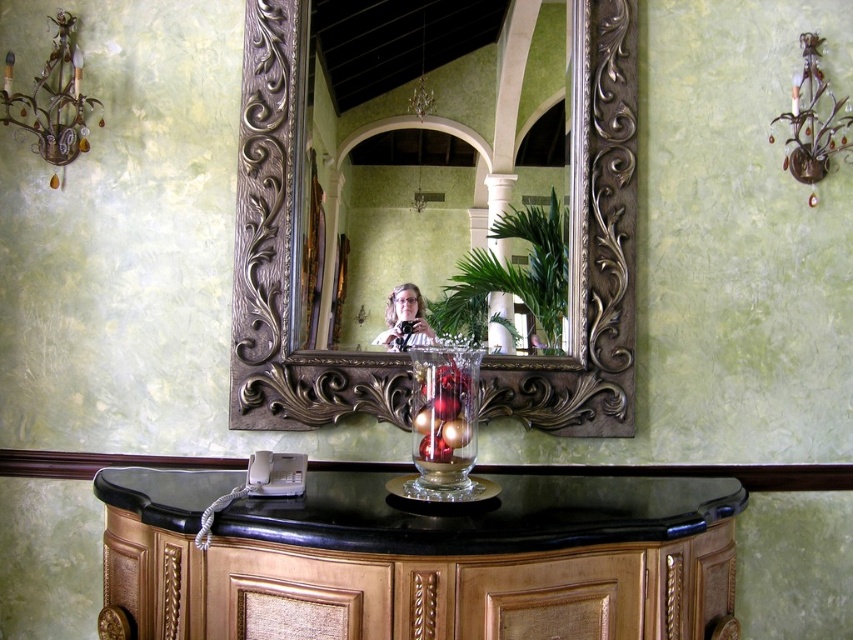
You are a guest in this room and want to place a small gift on the black marble vanity at lower center. However, you notice the gold ornate mirror at center is in the way. Can you move the gift to the vanity without moving the mirror?

The black marble vanity at lower center is positioned on the left side of the gold ornate mirror at center, so you can move the gift to the vanity by approaching from the left side of the mirror.

You are standing in the room and want to take a photo of the black marble vanity at lower center and the matte black camera at center. Which object should you focus on first if you want to capture both in a single frame without moving the camera?

You should focus on the black marble vanity at lower center first because it is closer to the viewer than the matte black camera at center. By focusing on the closer object, the camera can still capture the matte black camera at center in the background with proper depth of field.